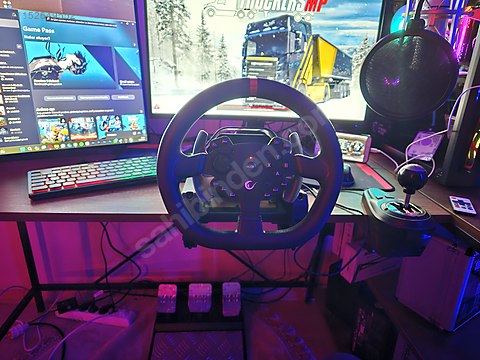
This screenshot has width=480, height=360. In order to click on middle monitor in this screenshot , I will do `click(297, 37)`.